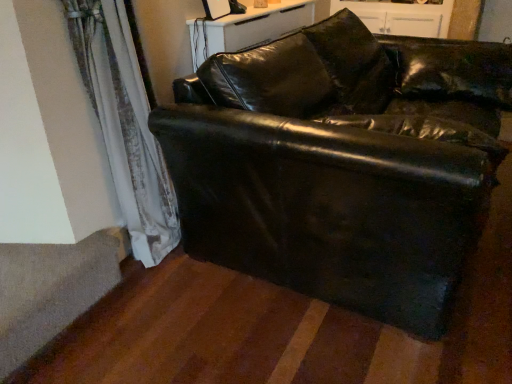
Question: From a real-world perspective, relative to black leather couch at center, is white glossy dresser at upper center vertically above or below?

Choices:
 (A) below
 (B) above

Answer: (B)

Question: Considering the positions of white glossy dresser at upper center and black leather couch at center in the image, is white glossy dresser at upper center bigger or smaller than black leather couch at center?

Choices:
 (A) small
 (B) big

Answer: (A)

Question: Estimate the real-world distances between objects in this image. Which object is farther from the black leather couch at center?

Choices:
 (A) white glossy dresser at upper center
 (B) gray carpet at lower left
 (C) satin white curtain at lower left

Answer: (A)

Question: Which of these objects is positioned farthest from the white glossy dresser at upper center?

Choices:
 (A) satin white curtain at lower left
 (B) black leather couch at center
 (C) gray carpet at lower left

Answer: (C)